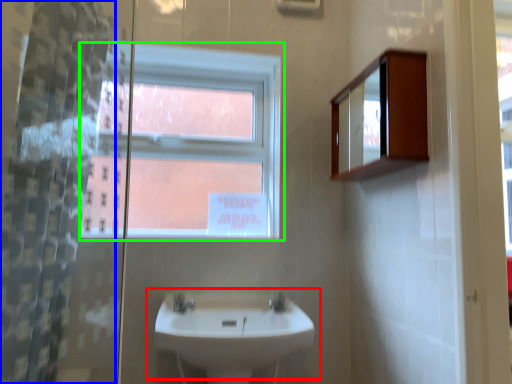
Question: Which object is positioned farthest from sink (highlighted by a red box)? Select from shower curtain (highlighted by a blue box) and window (highlighted by a green box).

Choices:
 (A) shower curtain
 (B) window

Answer: (A)